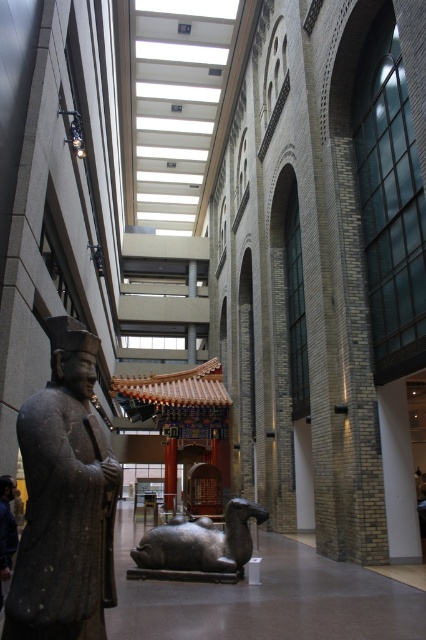
Question: Which object is closer to the camera taking this photo?

Choices:
 (A) matte gray statue at left
 (B) polished bronze statue at center

Answer: (A)

Question: Where is matte gray statue at left located in relation to polished bronze statue at center in the image?

Choices:
 (A) left
 (B) right

Answer: (A)

Question: Does matte gray statue at left have a lesser width compared to polished bronze statue at center?

Choices:
 (A) no
 (B) yes

Answer: (A)

Question: Can you confirm if matte gray statue at left is positioned to the left of polished bronze statue at center?

Choices:
 (A) no
 (B) yes

Answer: (B)

Question: Which point appears farthest from the camera in this image?

Choices:
 (A) (51, 560)
 (B) (6, 572)

Answer: (B)

Question: Which of the following is the closest to the observer?

Choices:
 (A) dark gray stone statue at left
 (B) matte gray statue at left
 (C) polished bronze statue at center

Answer: (B)